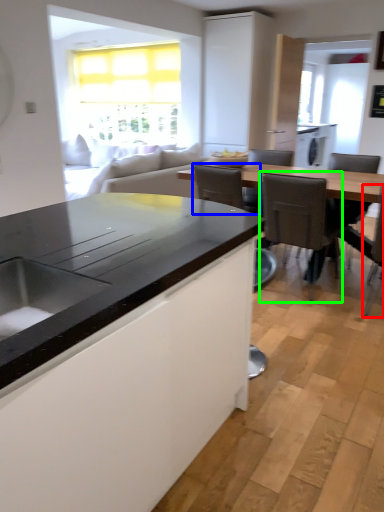
Question: Which object is the farthest from chair (highlighted by a red box)? Choose among these: armchair (highlighted by a blue box) or chair (highlighted by a green box).

Choices:
 (A) armchair
 (B) chair

Answer: (A)